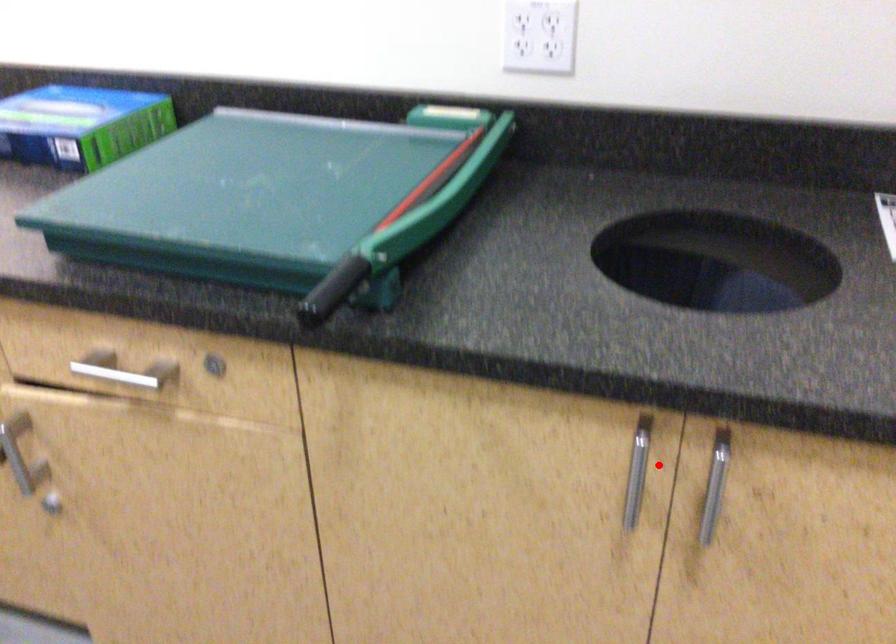
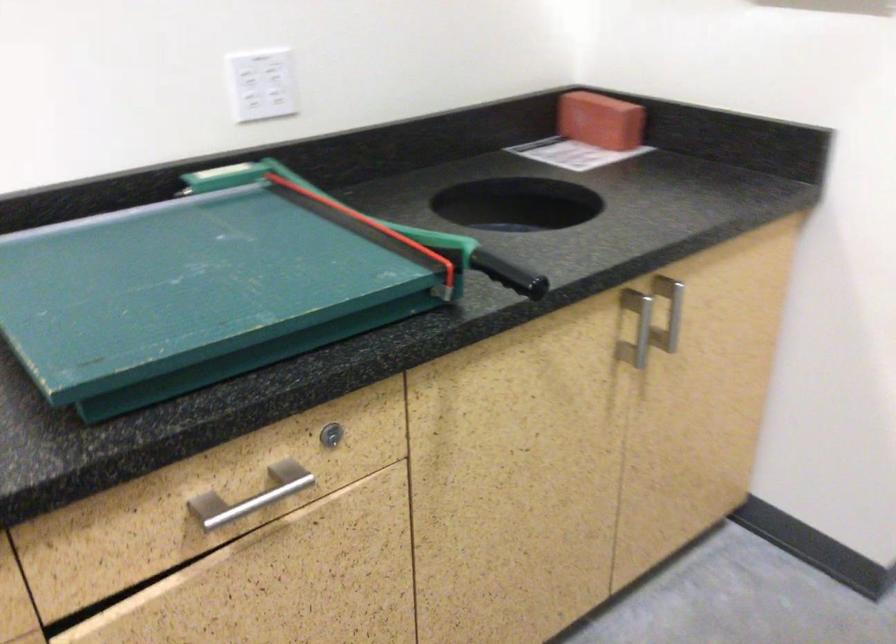
The point at the highlighted location is marked in the first image. Where is the corresponding point in the second image?

(638, 324)